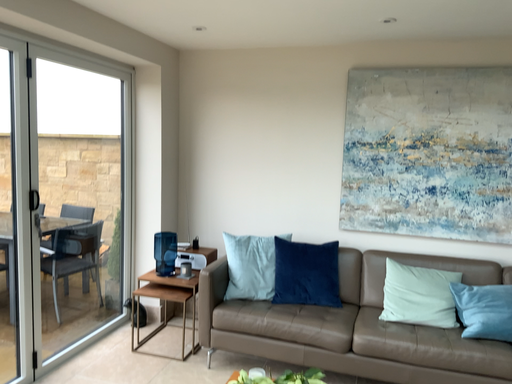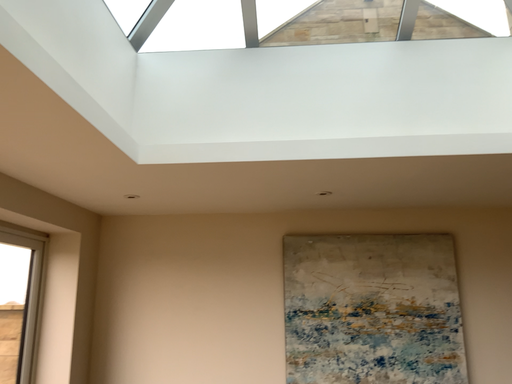
Question: How did the camera likely rotate when shooting the video?

Choices:
 (A) rotated left
 (B) rotated right

Answer: (B)